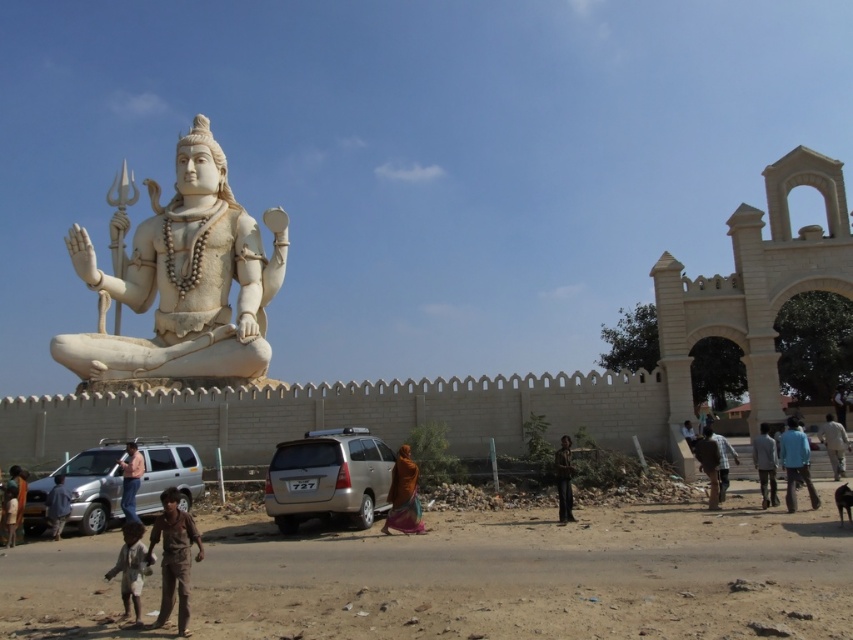
Question: Is brown fabric pants at lower center bigger than blue cotton shirt at lower right?

Choices:
 (A) yes
 (B) no

Answer: (B)

Question: Which point is closer to the camera?

Choices:
 (A) (402, 525)
 (B) (791, 444)

Answer: (A)

Question: Which object is the closest to the brown fabric at lower left?

Choices:
 (A) blue cotton shirt at lower right
 (B) brown fabric shirt at center

Answer: (B)

Question: Is light brown leather jacket at lower left positioned behind brown fabric at lower left?

Choices:
 (A) no
 (B) yes

Answer: (A)

Question: From the image, what is the correct spatial relationship of brown cotton shirt at lower left in relation to blue fabric pants at lower right?

Choices:
 (A) above
 (B) below

Answer: (B)

Question: Which object is positioned farthest from the dirt field at lower center?

Choices:
 (A) brown cotton shirt at lower left
 (B) brown fabric pants at lower center
 (C) light blue shirt at center

Answer: (C)